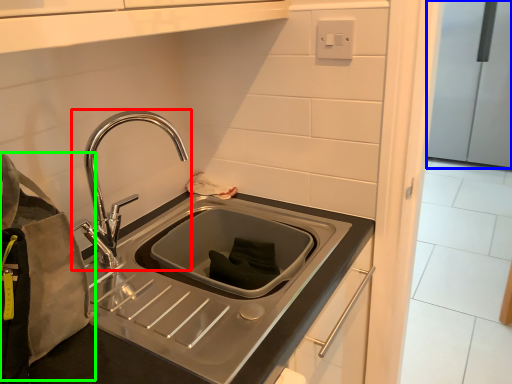
Question: Which object is the farthest from tap (highlighted by a red box)? Choose among these: appliance (highlighted by a blue box) or pouch (highlighted by a green box).

Choices:
 (A) appliance
 (B) pouch

Answer: (A)